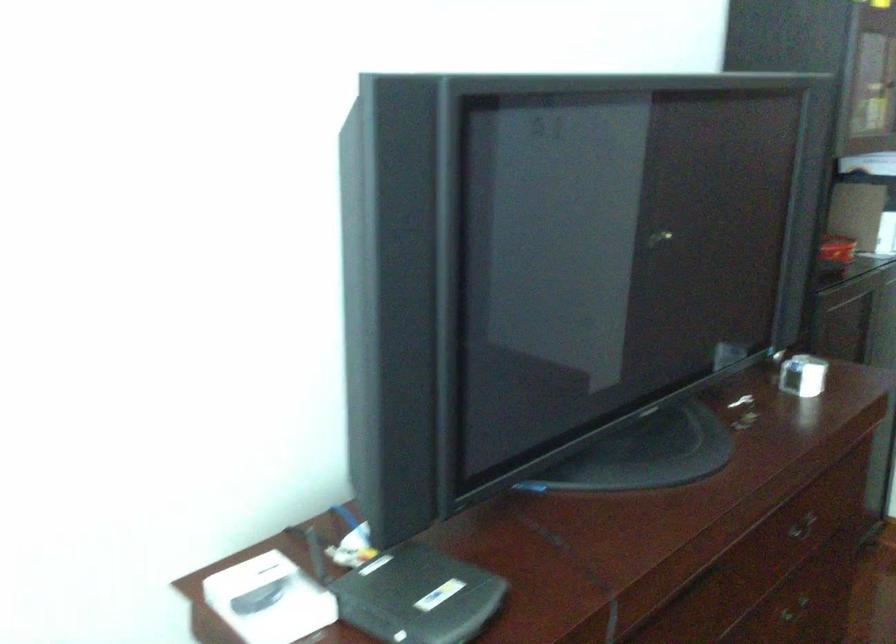
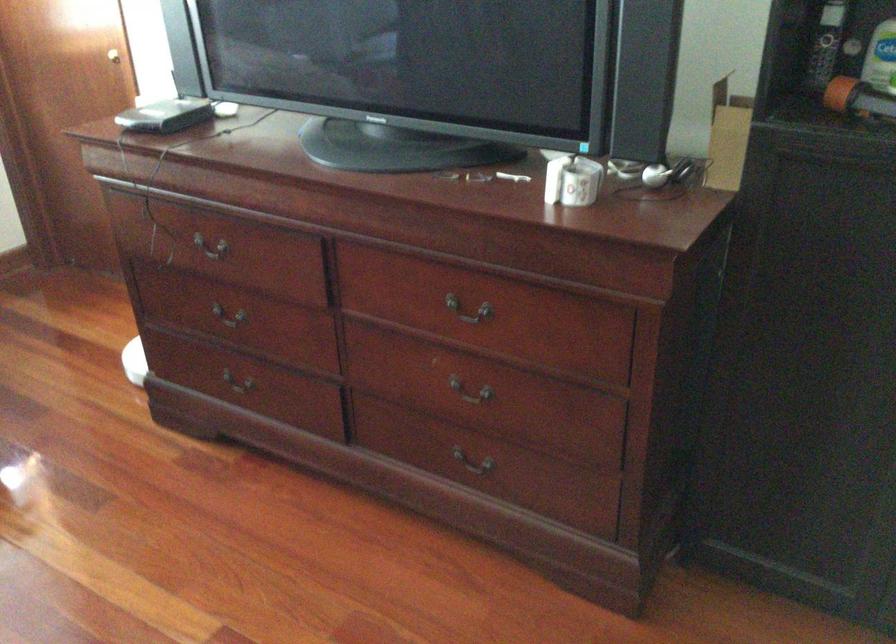
Find the pixel in the second image that matches the point at 759,542 in the first image.

(469, 310)